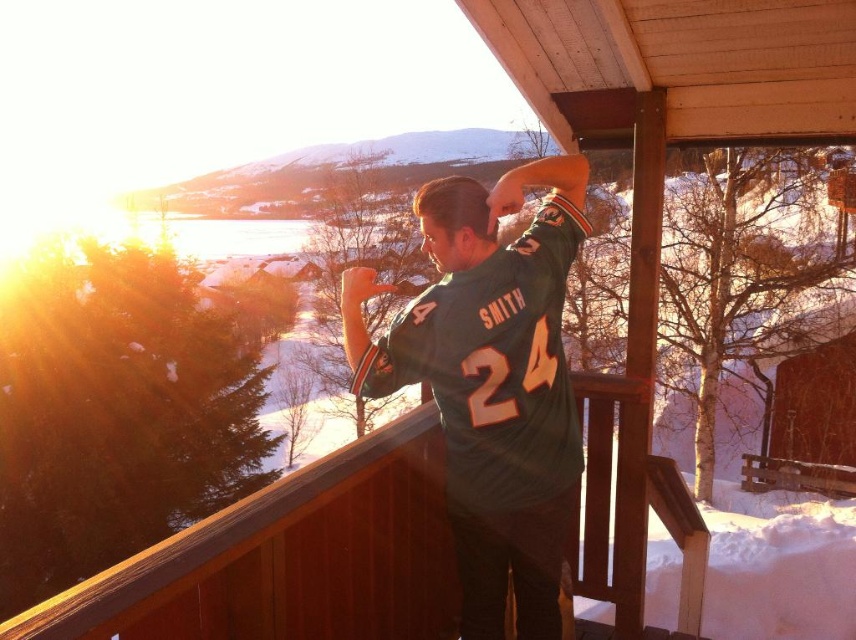
Can you confirm if brown wooden porch at center is wider than green jersey at center?

Yes.

Between point (270, 524) and point (535, 451), which one is positioned behind?

Positioned behind is point (535, 451).

Describe the element at coordinates (289, 557) in the screenshot. The width and height of the screenshot is (856, 640). I see `brown wooden porch at center` at that location.

Where is `brown wooden porch at center`? This screenshot has width=856, height=640. brown wooden porch at center is located at coordinates (289, 557).